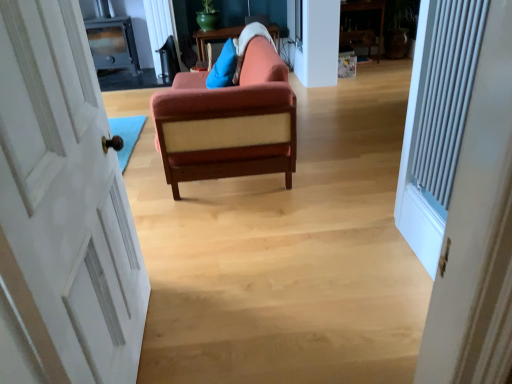
Question: Can you confirm if white painted wood door at left is shorter than velvet orange couch at center?

Choices:
 (A) no
 (B) yes

Answer: (A)

Question: Considering the relative sizes of white painted wood door at left and velvet orange couch at center in the image provided, is white painted wood door at left wider than velvet orange couch at center?

Choices:
 (A) no
 (B) yes

Answer: (A)

Question: Would you consider white painted wood door at left to be distant from velvet orange couch at center?

Choices:
 (A) no
 (B) yes

Answer: (B)

Question: Does white painted wood door at left have a smaller size compared to velvet orange couch at center?

Choices:
 (A) yes
 (B) no

Answer: (A)

Question: Does white painted wood door at left have a greater height compared to velvet orange couch at center?

Choices:
 (A) yes
 (B) no

Answer: (A)

Question: Considering the relative positions of white painted wood door at left and velvet orange couch at center in the image provided, is white painted wood door at left in front of velvet orange couch at center?

Choices:
 (A) no
 (B) yes

Answer: (B)

Question: Is white painted wood door at left wider than white textured radiator at right?

Choices:
 (A) no
 (B) yes

Answer: (B)

Question: From a real-world perspective, is white painted wood door at left beneath white textured radiator at right?

Choices:
 (A) yes
 (B) no

Answer: (A)

Question: Considering the relative sizes of white painted wood door at left and white textured radiator at right in the image provided, is white painted wood door at left thinner than white textured radiator at right?

Choices:
 (A) yes
 (B) no

Answer: (B)

Question: Is white painted wood door at left with white textured radiator at right?

Choices:
 (A) no
 (B) yes

Answer: (A)

Question: Does white painted wood door at left have a greater height compared to white textured radiator at right?

Choices:
 (A) yes
 (B) no

Answer: (A)

Question: From the image's perspective, is white painted wood door at left located beneath white textured radiator at right?

Choices:
 (A) no
 (B) yes

Answer: (B)

Question: Could you tell me if velvet orange couch at center is turned towards white textured radiator at right?

Choices:
 (A) no
 (B) yes

Answer: (A)